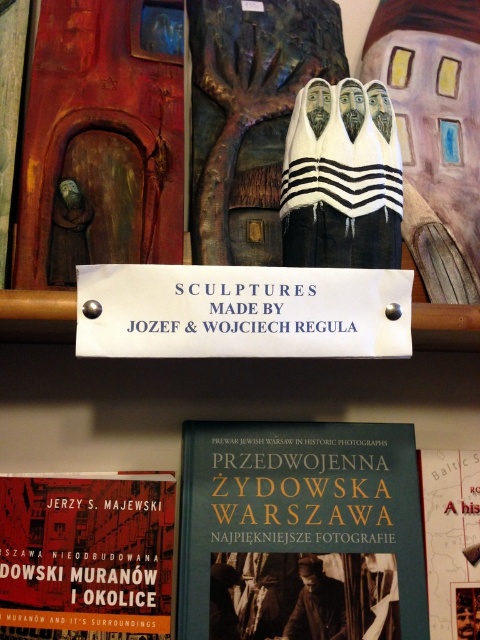
Does matte red book at lower left appear over matte paper book at center?

Yes, matte red book at lower left is above matte paper book at center.

Does matte red book at lower left lie behind matte paper book at center?

No.

Does point (144, 541) come in front of point (467, 588)?

Yes, it is.

The image size is (480, 640). I want to click on matte red book at lower left, so click(86, 556).

Is hardcover book at center below matte paper book at center?

No.

Does hardcover book at center have a lesser height compared to matte paper book at center?

In fact, hardcover book at center may be taller than matte paper book at center.

This screenshot has height=640, width=480. Identify the location of hardcover book at center. (300, 532).

Find the location of a particular element. The width and height of the screenshot is (480, 640). hardcover book at center is located at coordinates (300, 532).

Does hardcover book at center lie behind matte red book at lower left?

Yes, it is behind matte red book at lower left.

Which is more to the right, hardcover book at center or matte red book at lower left?

From the viewer's perspective, hardcover book at center appears more on the right side.

Who is more forward, (285, 452) or (154, 552)?

Point (154, 552) is in front.

Locate an element on the screen. hardcover book at center is located at coordinates tap(300, 532).